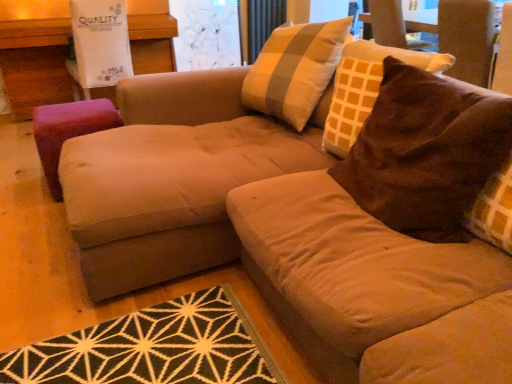
Question: Can you confirm if brown suede swivel chair at upper right is taller than brown suede pillow at upper right?

Choices:
 (A) yes
 (B) no

Answer: (B)

Question: Is brown suede swivel chair at upper right positioned with its back to brown suede pillow at upper right?

Choices:
 (A) yes
 (B) no

Answer: (B)

Question: Is brown suede swivel chair at upper right positioned beyond the bounds of brown suede pillow at upper right?

Choices:
 (A) yes
 (B) no

Answer: (A)

Question: Is brown suede swivel chair at upper right smaller than brown suede pillow at upper right?

Choices:
 (A) yes
 (B) no

Answer: (A)

Question: Can you confirm if brown suede swivel chair at upper right is thinner than brown suede pillow at upper right?

Choices:
 (A) yes
 (B) no

Answer: (B)

Question: Considering the relative sizes of brown suede swivel chair at upper right and brown suede pillow at upper right in the image provided, is brown suede swivel chair at upper right shorter than brown suede pillow at upper right?

Choices:
 (A) yes
 (B) no

Answer: (A)

Question: Is brown suede pillow at upper right further to camera compared to brown suede swivel chair at upper right?

Choices:
 (A) no
 (B) yes

Answer: (A)

Question: Considering the relative positions of brown suede pillow at upper right and brown suede swivel chair at upper right in the image provided, is brown suede pillow at upper right to the right of brown suede swivel chair at upper right from the viewer's perspective?

Choices:
 (A) no
 (B) yes

Answer: (A)

Question: Is brown suede pillow at upper right facing towards brown suede swivel chair at upper right?

Choices:
 (A) no
 (B) yes

Answer: (A)

Question: From a real-world perspective, is brown suede pillow at upper right located beneath brown suede swivel chair at upper right?

Choices:
 (A) no
 (B) yes

Answer: (B)

Question: From the image's perspective, is brown suede pillow at upper right on top of brown suede swivel chair at upper right?

Choices:
 (A) no
 (B) yes

Answer: (A)

Question: Is brown suede pillow at upper right in contact with brown suede swivel chair at upper right?

Choices:
 (A) yes
 (B) no

Answer: (B)

Question: From the image's perspective, is transparent glass screen door at upper center over purple fabric stool at left?

Choices:
 (A) no
 (B) yes

Answer: (B)